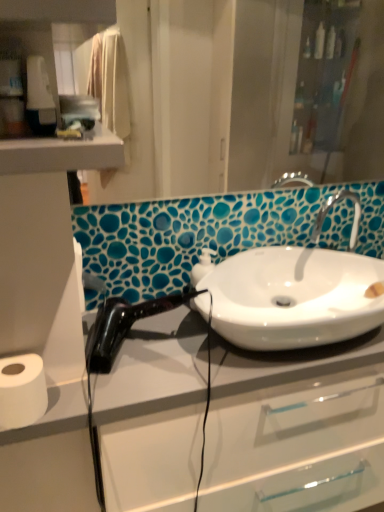
Question: Is white glossy sink at center taller or shorter than matte glass mirror at upper center?

Choices:
 (A) tall
 (B) short

Answer: (B)

Question: From the image's perspective, is white glossy sink at center above or below matte glass mirror at upper center?

Choices:
 (A) below
 (B) above

Answer: (A)

Question: Which object is positioned closest to the black plastic hair dryer at upper left?

Choices:
 (A) black glossy hair dryer at left
 (B) white matte toilet paper at lower left
 (C) matte glass mirror at upper center
 (D) white glossy sink at center

Answer: (B)

Question: Which of these objects is positioned farthest from the black glossy hair dryer at left?

Choices:
 (A) white matte toilet paper at lower left
 (B) white glossy sink at center
 (C) black plastic hair dryer at upper left
 (D) matte glass mirror at upper center

Answer: (D)